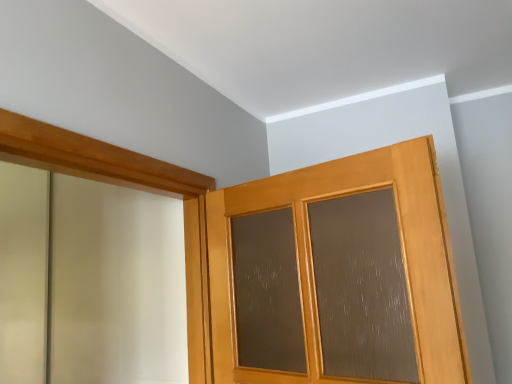
Question: Is matte wood door at center not inside wooden barn door at upper left?

Choices:
 (A) yes
 (B) no

Answer: (A)

Question: Does matte wood door at center have a lesser height compared to wooden barn door at upper left?

Choices:
 (A) yes
 (B) no

Answer: (A)

Question: Can you confirm if matte wood door at center is positioned to the right of wooden barn door at upper left?

Choices:
 (A) no
 (B) yes

Answer: (B)

Question: Does matte wood door at center touch wooden barn door at upper left?

Choices:
 (A) yes
 (B) no

Answer: (B)

Question: Is matte wood door at center surrounding wooden barn door at upper left?

Choices:
 (A) no
 (B) yes

Answer: (A)

Question: Is the position of matte wood door at center more distant than that of wooden barn door at upper left?

Choices:
 (A) yes
 (B) no

Answer: (A)

Question: Is matte wood door at center at the back of wooden barn door at upper left?

Choices:
 (A) no
 (B) yes

Answer: (A)

Question: Does wooden barn door at upper left have a greater width compared to matte wood door at center?

Choices:
 (A) yes
 (B) no

Answer: (B)

Question: From a real-world perspective, does wooden barn door at upper left stand above matte wood door at center?

Choices:
 (A) no
 (B) yes

Answer: (B)

Question: Is wooden barn door at upper left not close to matte wood door at center?

Choices:
 (A) no
 (B) yes

Answer: (A)

Question: From the image's perspective, is wooden barn door at upper left on top of matte wood door at center?

Choices:
 (A) yes
 (B) no

Answer: (A)

Question: From a real-world perspective, is wooden barn door at upper left located beneath matte wood door at center?

Choices:
 (A) yes
 (B) no

Answer: (B)

Question: From a real-world perspective, is wooden barn door at upper left positioned above or below matte wood door at center?

Choices:
 (A) below
 (B) above

Answer: (B)